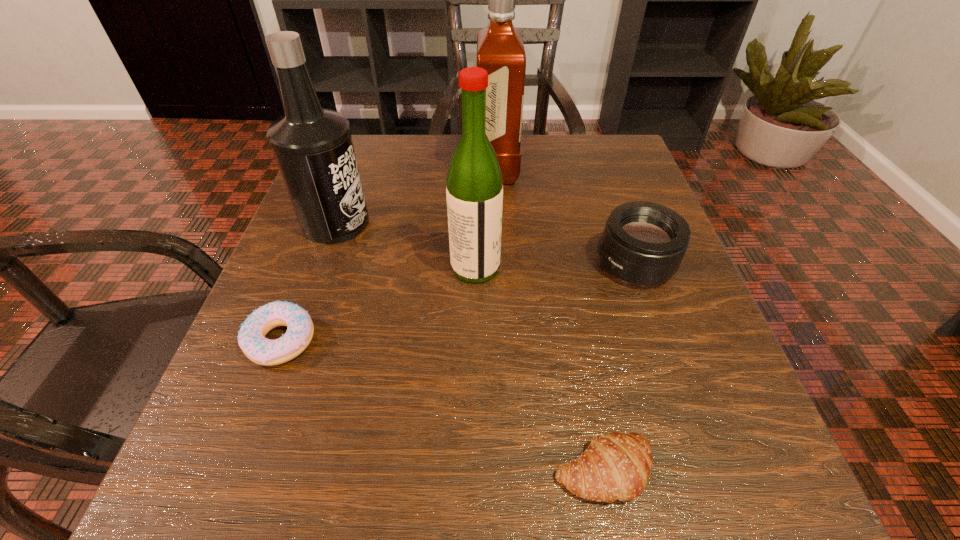
The height and width of the screenshot is (540, 960). What are the coordinates of `object that is the nearest to the nearest object` in the screenshot? It's located at (643, 243).

Find the location of `liquor that stands as the second closest to the nearest liquor`. liquor that stands as the second closest to the nearest liquor is located at coordinates (500, 50).

Locate which liquor is the second closest to the doughnut. Please provide its 2D coordinates. Your answer should be formatted as a tuple, i.e. [(x, y)], where the tuple contains the x and y coordinates of a point satisfying the conditions above.

[(474, 191)]

Where is `free space that satisfies the following two spatial constraints: 1. on the front label of the crescent roll; 2. on the left side of the leftmost liquor`? Image resolution: width=960 pixels, height=540 pixels. free space that satisfies the following two spatial constraints: 1. on the front label of the crescent roll; 2. on the left side of the leftmost liquor is located at coordinates (248, 471).

I want to click on free space that satisfies the following two spatial constraints: 1. on the front side of the nearest object; 2. on the left side of the doughnut, so point(231,471).

You are a GUI agent. You are given a task and a screenshot of the screen. Output one action in this format:
    pyautogui.click(x=<x>, y=<y>)
    Task: Click on the vacant space that satisfies the following two spatial constraints: 1. on the front label of the farthest object; 2. on the right side of the nearest object
    The image size is (960, 540).
    Given the screenshot: What is the action you would take?
    pyautogui.click(x=511, y=471)

The width and height of the screenshot is (960, 540). I want to click on blank space that satisfies the following two spatial constraints: 1. on the label of the nearest liquor; 2. on the back side of the nearest object, so (x=473, y=471).

Image resolution: width=960 pixels, height=540 pixels. Identify the location of vacant space that satisfies the following two spatial constraints: 1. on the back side of the crescent roll; 2. on the label of the nearest liquor. (564, 267).

Locate an element on the screen. free location that satisfies the following two spatial constraints: 1. on the front label of the crescent roll; 2. on the right side of the leftmost liquor is located at coordinates (248, 471).

Image resolution: width=960 pixels, height=540 pixels. In order to click on free space that satisfies the following two spatial constraints: 1. on the back side of the crescent roll; 2. on the front label of the second farthest liquor in this screenshot , I will do `click(557, 223)`.